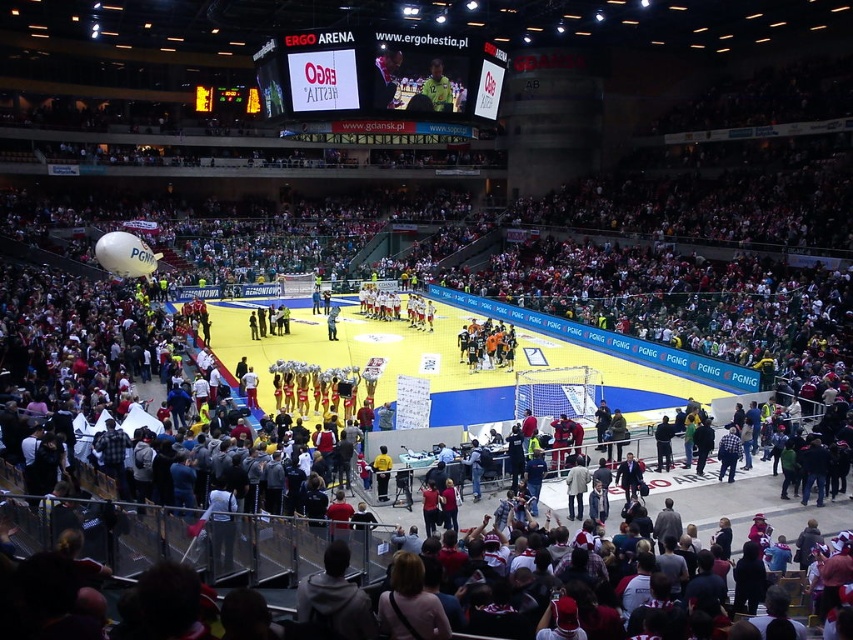
You are a drone operator tasked with capturing aerial footage of the Ergo Arena. Your drone is currently hovering above the basketball court. According to the image, where exactly is the yellow synthetic turf at center located in terms of coordinates?

The yellow synthetic turf at center is located at point coordinates of (485, 360).